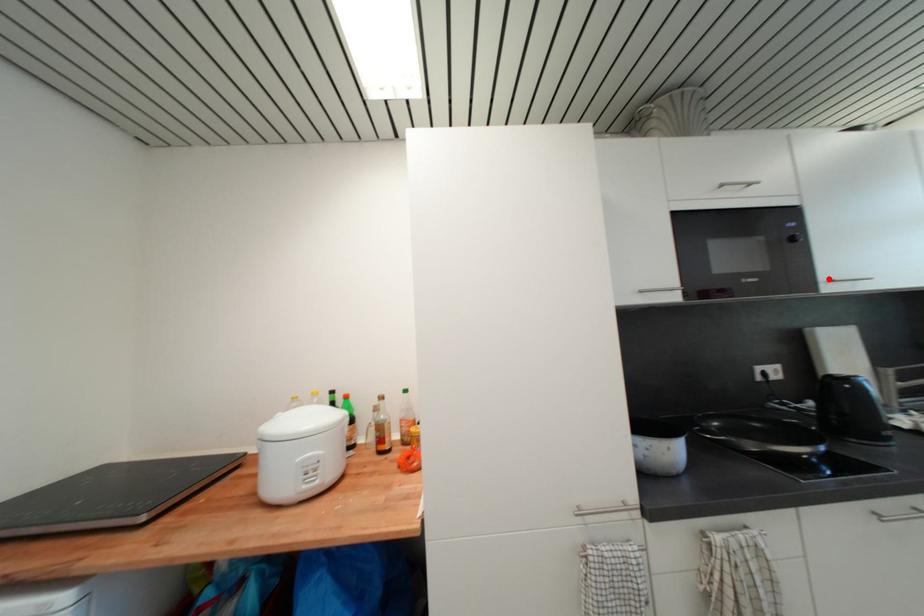
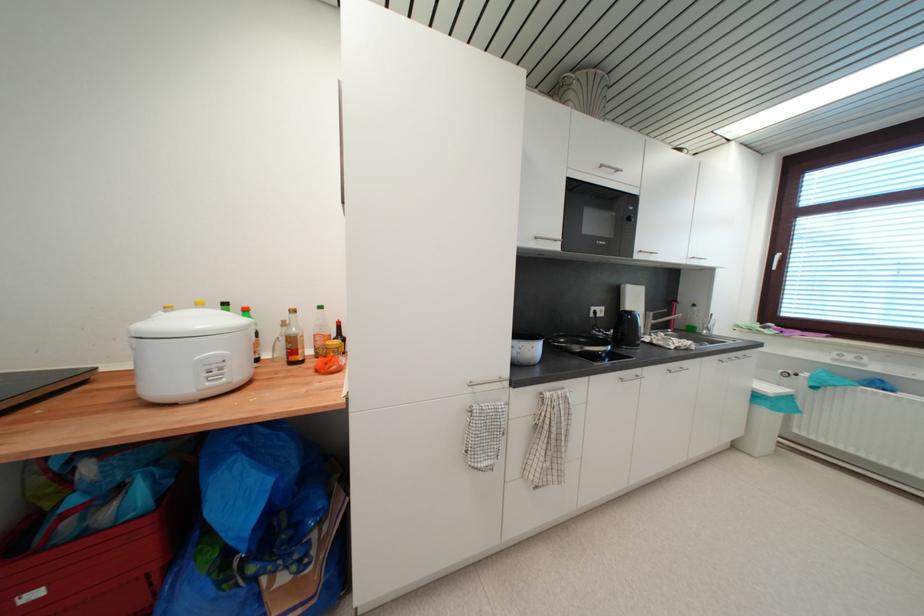
Locate, in the second image, the point that corresponds to the highlighted location in the first image.

(642, 251)